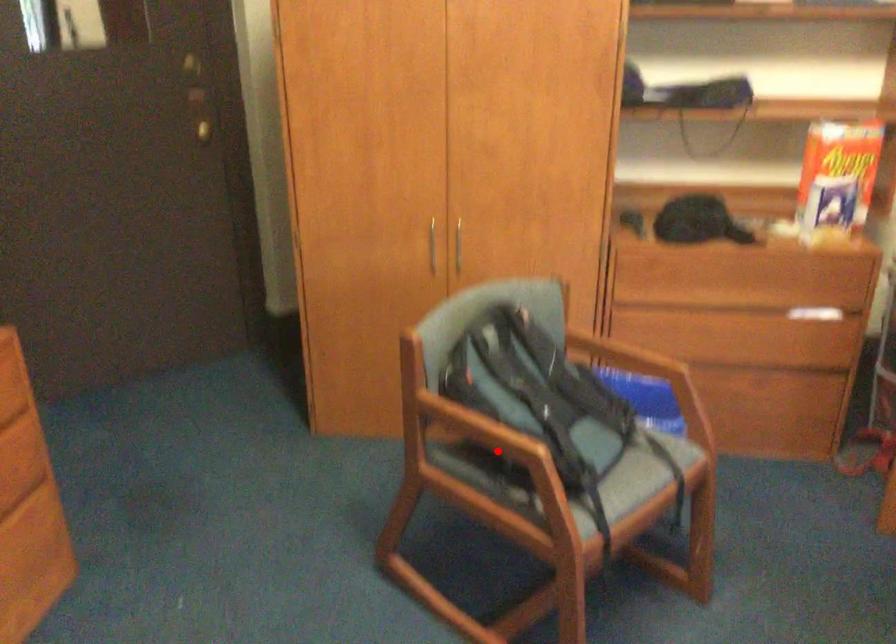
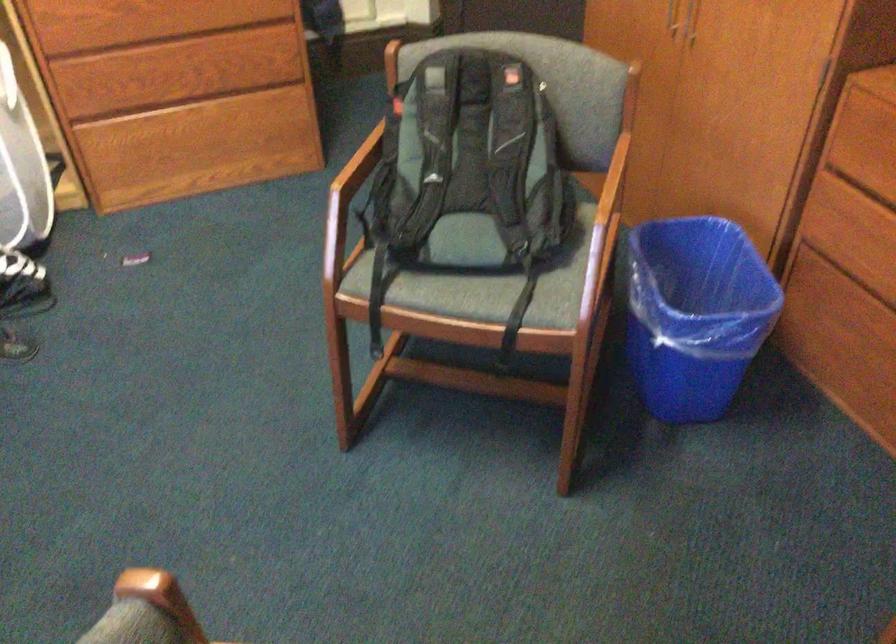
Locate, in the second image, the point that corresponds to the highlighted location in the first image.

(350, 183)